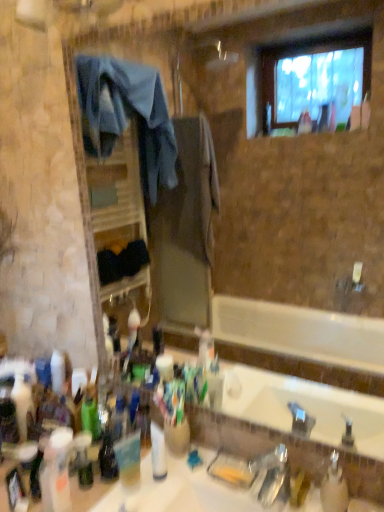
This screenshot has width=384, height=512. Identify the location of vacant space that is to the left of metallic silver faucet at lower center. (200, 494).